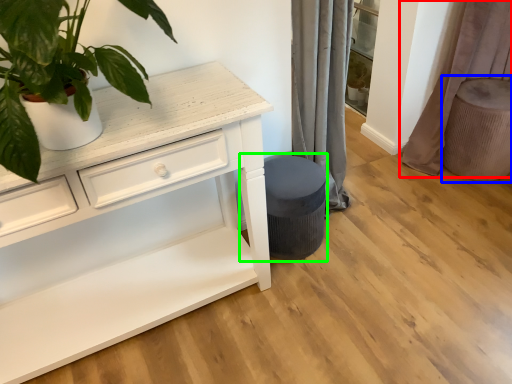
Question: Which object is positioned closest to curtain (highlighted by a red box)? Select from swivel chair (highlighted by a blue box) and music stool (highlighted by a green box).

Choices:
 (A) swivel chair
 (B) music stool

Answer: (A)